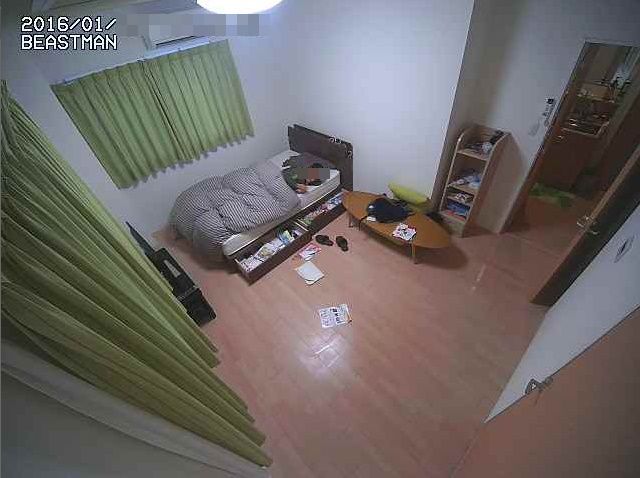
The height and width of the screenshot is (478, 640). Find the location of `brown hardwood oval table`. brown hardwood oval table is located at coordinates (425, 225).